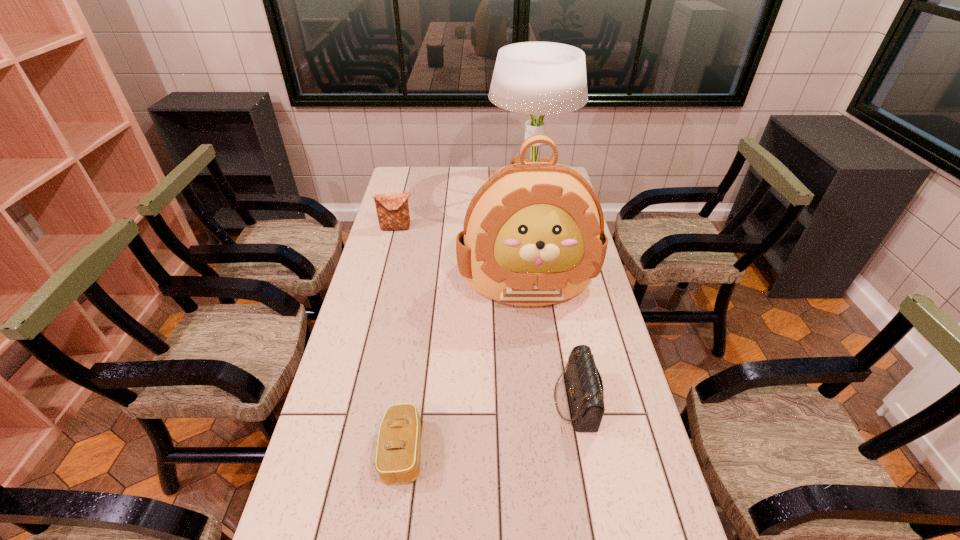
Identify the location of free space between the lamp and the third shortest object. (463, 211).

Where is `free space between the third farthest object and the fourth tallest object`? The width and height of the screenshot is (960, 540). free space between the third farthest object and the fourth tallest object is located at coordinates (551, 341).

Find the location of `free space between the tallest clutch bag and the second shortest object`. free space between the tallest clutch bag and the second shortest object is located at coordinates (486, 315).

At what (x,y) coordinates should I click in order to perform the action: click on free spot between the leftmost object and the lamp. Please return your answer as a coordinate pair (x, y). Image resolution: width=960 pixels, height=540 pixels. Looking at the image, I should click on (463, 211).

Identify the location of vacant space that's between the second clutch bag from left to right and the lamp. (467, 322).

At what (x,y) coordinates should I click in order to perform the action: click on object that is the closest one to the backpack. Please return your answer as a coordinate pair (x, y). Looking at the image, I should click on (585, 386).

Identify which object is located as the nearest to the second tallest clutch bag. Please provide its 2D coordinates. Your answer should be formatted as a tuple, i.e. [(x, y)], where the tuple contains the x and y coordinates of a point satisfying the conditions above.

[(533, 235)]

Identify which clutch bag is located as the second nearest to the farthest object. Please provide its 2D coordinates. Your answer should be formatted as a tuple, i.e. [(x, y)], where the tuple contains the x and y coordinates of a point satisfying the conditions above.

[(585, 386)]

Identify which clutch bag is the third closest to the lamp. Please provide its 2D coordinates. Your answer should be formatted as a tuple, i.e. [(x, y)], where the tuple contains the x and y coordinates of a point satisfying the conditions above.

[(398, 453)]

I want to click on vacant space that satisfies the following two spatial constraints: 1. on the front-facing side of the third nearest object; 2. on the zipper side of the shortest clutch bag, so click(x=548, y=451).